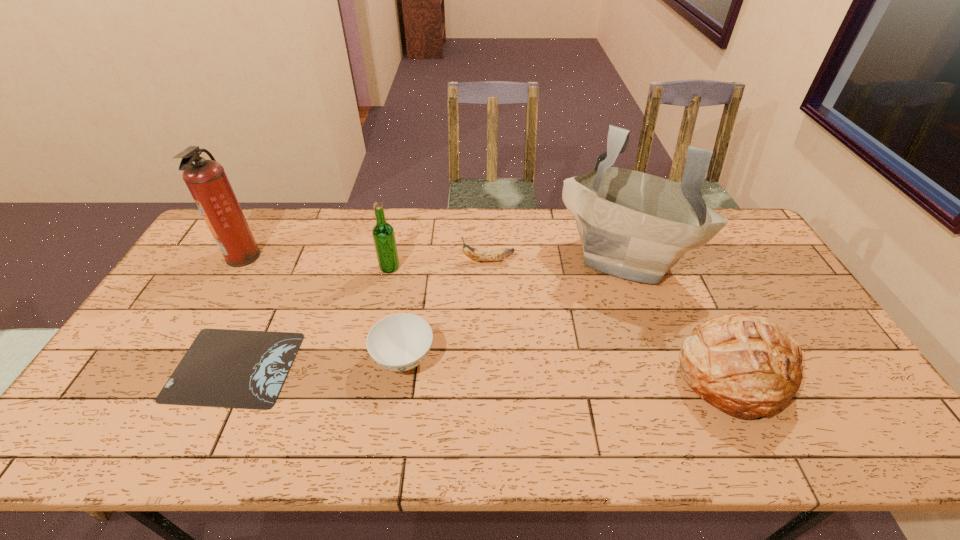
You are a GUI agent. You are given a task and a screenshot of the screen. Output one action in this format:
    pyautogui.click(x=<x>, y=<y>)
    Task: Click on the shopping bag
    The width and height of the screenshot is (960, 540).
    Given the screenshot: What is the action you would take?
    pyautogui.click(x=632, y=225)

This screenshot has height=540, width=960. In order to click on fire extinguisher in this screenshot , I will do `click(206, 180)`.

This screenshot has width=960, height=540. Find the location of `beer bottle`. beer bottle is located at coordinates (383, 234).

Locate an element on the screen. This screenshot has height=540, width=960. the fourth tallest object is located at coordinates (740, 363).

Image resolution: width=960 pixels, height=540 pixels. What are the coordinates of `the third object from right to left` in the screenshot? It's located at (478, 255).

The image size is (960, 540). What are the coordinates of `chinaware` in the screenshot? It's located at (399, 342).

The image size is (960, 540). Find the location of `mousepad`. mousepad is located at coordinates (244, 369).

This screenshot has width=960, height=540. Identify the location of vacant area situated 0.090m on the left of the shopping bag. (533, 256).

I want to click on vacant region located at the nozzle of the fire extinguisher, so click(350, 256).

Locate an element on the screen. free region located on the back of the fifth shortest object is located at coordinates (397, 232).